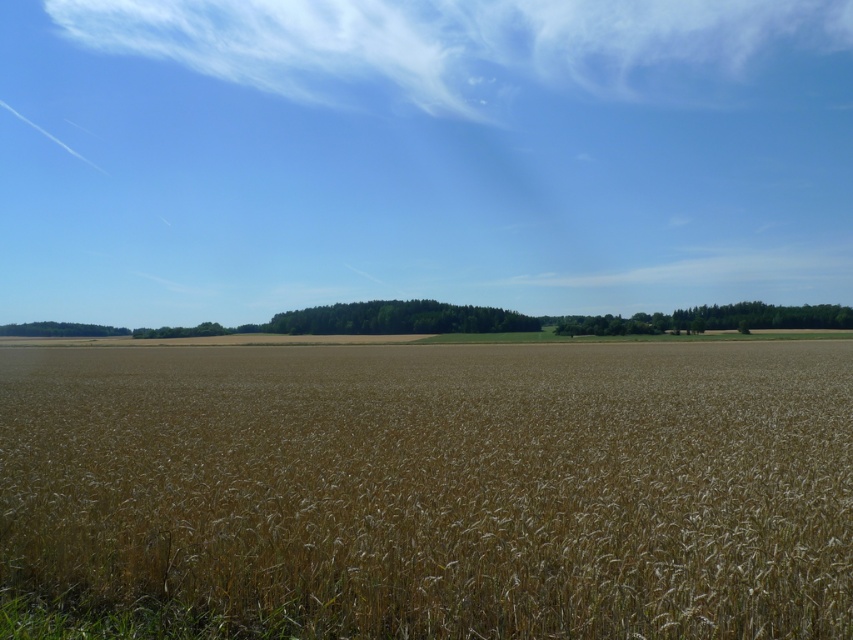
Is transparent blue sky at upper center smaller than white fluffy cloud at upper center?

Incorrect, transparent blue sky at upper center is not smaller in size than white fluffy cloud at upper center.

Can you confirm if transparent blue sky at upper center is positioned above white fluffy cloud at upper center?

Incorrect, transparent blue sky at upper center is not positioned above white fluffy cloud at upper center.

This screenshot has width=853, height=640. In order to click on transparent blue sky at upper center in this screenshot , I will do pos(421,156).

Does brown grainy wheat field at center have a lesser height compared to white fluffy cloud at upper center?

Indeed, brown grainy wheat field at center has a lesser height compared to white fluffy cloud at upper center.

Who is shorter, brown grainy wheat field at center or white fluffy cloud at upper center?

Standing shorter between the two is brown grainy wheat field at center.

You are a GUI agent. You are given a task and a screenshot of the screen. Output one action in this format:
    pyautogui.click(x=<x>, y=<y>)
    Task: Click on the brown grainy wheat field at center
    The image size is (853, 640).
    Given the screenshot: What is the action you would take?
    pyautogui.click(x=439, y=486)

Describe the element at coordinates (421, 156) in the screenshot. I see `transparent blue sky at upper center` at that location.

Which is behind, point (267, 109) or point (695, 406)?

Point (267, 109)

Identify the location of transparent blue sky at upper center. (421, 156).